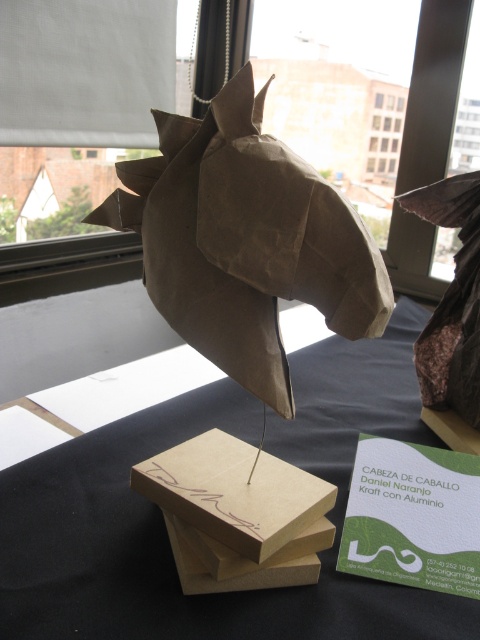
You are an art installer setting up an exhibition. You need to hang a decorative plaque that must be placed exactly 0.05 units below the brown paper horse head at upper center. Where should you position the plaque based on the coordinates provided?

The brown paper horse head at upper center is located at point (433,90). To place the plaque 0.05 units below it, you should position the plaque at coordinates (409,90).